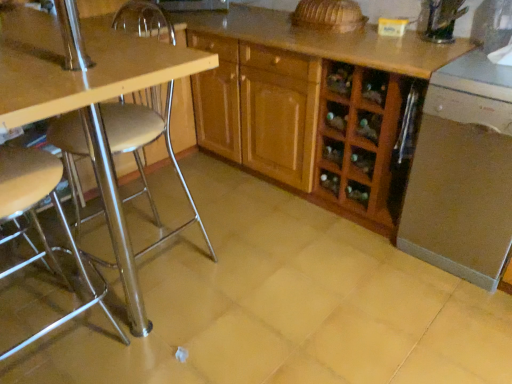
The width and height of the screenshot is (512, 384). Find the location of `unoccupied area behind wooden table at left`. unoccupied area behind wooden table at left is located at coordinates tap(176, 208).